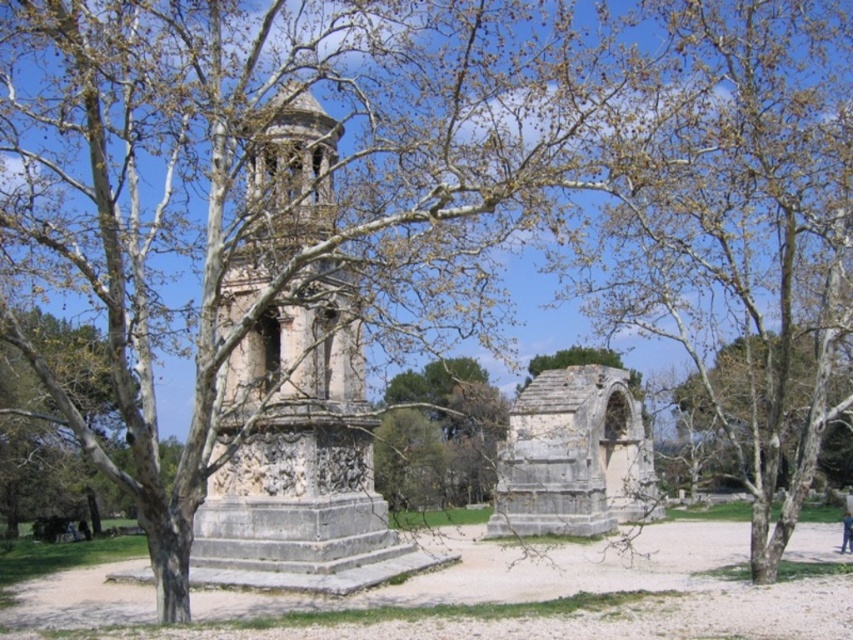
You are standing in the middle of the scene and see the gray stone arch at center and the brown leafy tree at center. Which object is positioned to the right of the other?

The gray stone arch at center is positioned to the right of the brown leafy tree at center.

You are standing at the base of the tall tower and want to walk towards the arched stone structure. Which point, point (231, 525) or point (646, 456), should you aim for to reach the arched structure?

You should aim for point (231, 525) because it is in front of point (646, 456), meaning it is closer to the arched stone structure.

You are an architect visiting this historical site. You notice the gray stone arch at center and the brown leafy tree at center. Which object is positioned lower in the scene?

The gray stone arch at center is positioned below the brown leafy tree at center, so it is lower in the scene.